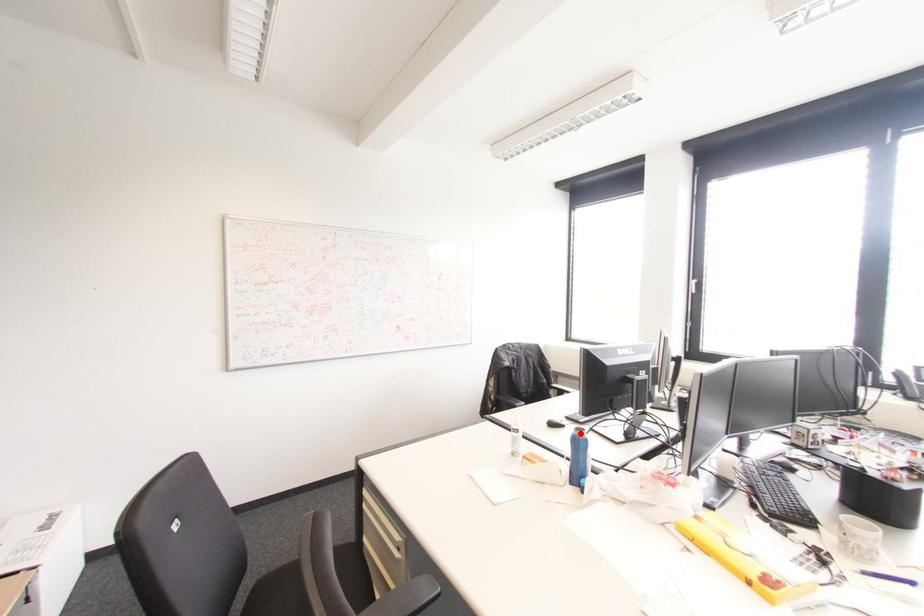
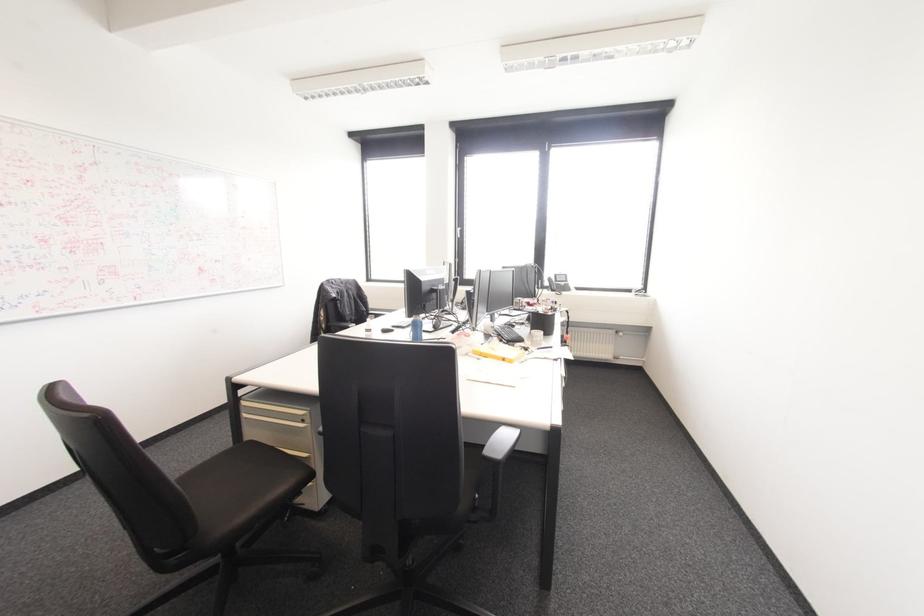
Question: I am providing you with two images of the same scene from different viewpoints. In image1, a red point is highlighted. Considering the same 3D point in image2, which of the following is correct?

Choices:
 (A) It is closer
 (B) It is farther

Answer: (B)